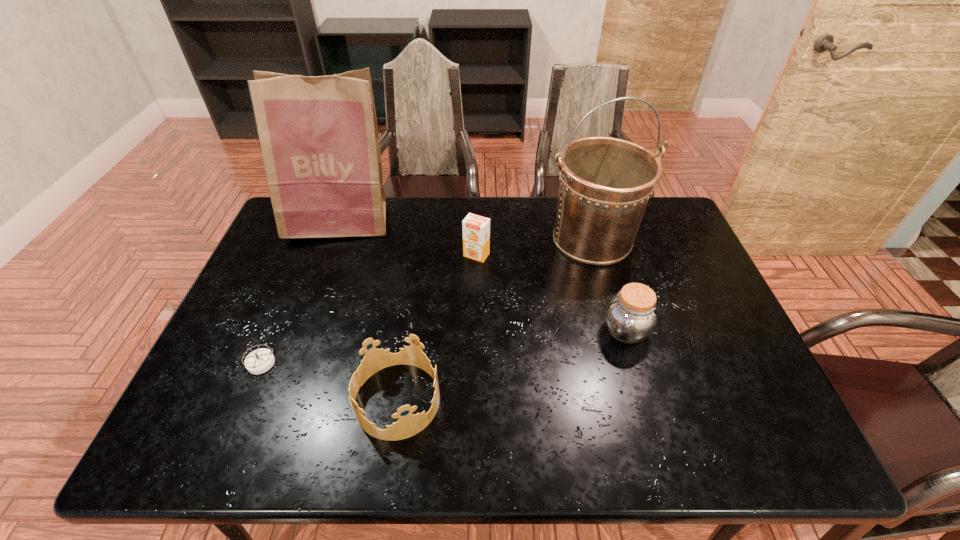
Find the location of a particular element. The image size is (960, 540). vacant region between the orange juice and the bucket is located at coordinates (535, 247).

This screenshot has width=960, height=540. I want to click on unoccupied area between the third object from right to left and the grocery bag, so pyautogui.click(x=408, y=239).

Locate an element on the screen. free spot between the grocery bag and the shortest object is located at coordinates (300, 293).

Identify the location of free space between the grocery bag and the jar. Image resolution: width=960 pixels, height=540 pixels. pos(483,276).

Identify which object is located as the fourth nearest to the jar. Please provide its 2D coordinates. Your answer should be formatted as a tuple, i.e. [(x, y)], where the tuple contains the x and y coordinates of a point satisfying the conditions above.

[(318, 135)]

Point out which object is positioned as the third nearest to the third object from right to left. Please provide its 2D coordinates. Your answer should be formatted as a tuple, i.e. [(x, y)], where the tuple contains the x and y coordinates of a point satisfying the conditions above.

[(631, 316)]

The width and height of the screenshot is (960, 540). I want to click on free space that satisfies the following two spatial constraints: 1. on the front-facing side of the bucket; 2. on the left side of the grocery bag, so click(334, 239).

Locate an element on the screen. Image resolution: width=960 pixels, height=540 pixels. vacant space that satisfies the following two spatial constraints: 1. on the front-facing side of the bucket; 2. on the right side of the grocery bag is located at coordinates (334, 239).

Locate an element on the screen. This screenshot has width=960, height=540. vacant space that satisfies the following two spatial constraints: 1. on the back side of the bucket; 2. on the left side of the compass is located at coordinates click(x=312, y=239).